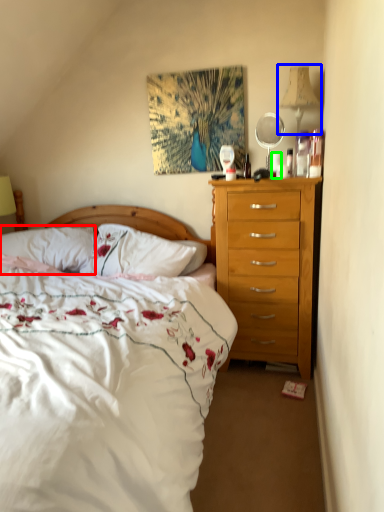
Question: Which is farther away from pillow (highlighted by a red box)? bedside lamp (highlighted by a blue box) or coffee cup (highlighted by a green box)?

Choices:
 (A) bedside lamp
 (B) coffee cup

Answer: (A)